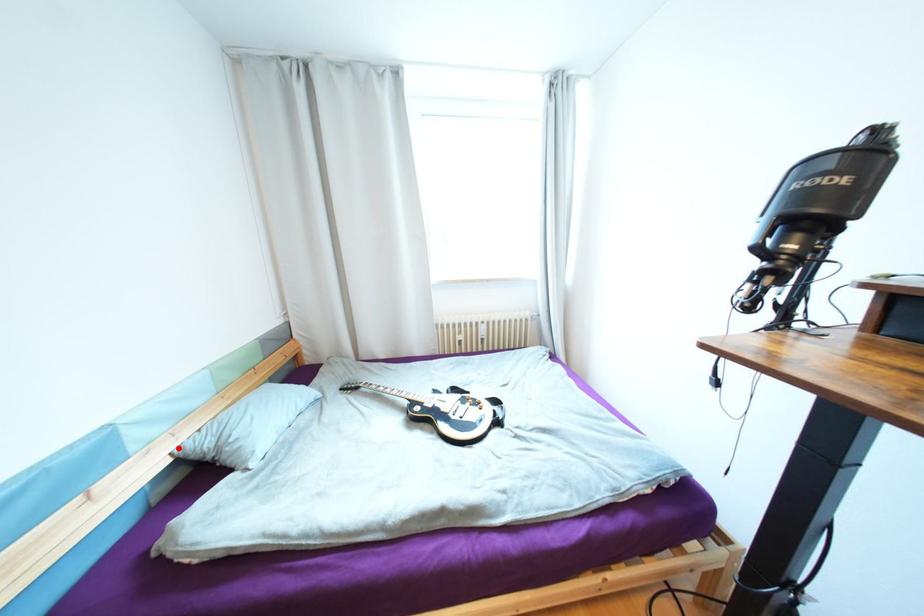
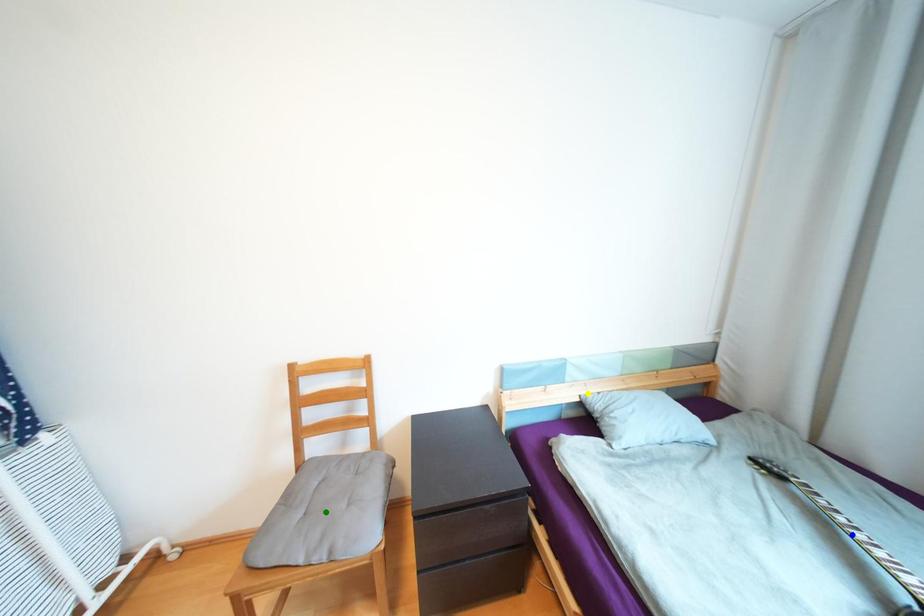
Question: I am providing you with two images of the same scene from different viewpoints. A red point is marked on the first image. You are given multiple points on the second image. Which point in image 2 is actually the same real-world point as the red point in image 1?

Choices:
 (A) blue point
 (B) yellow point
 (C) green point

Answer: (B)